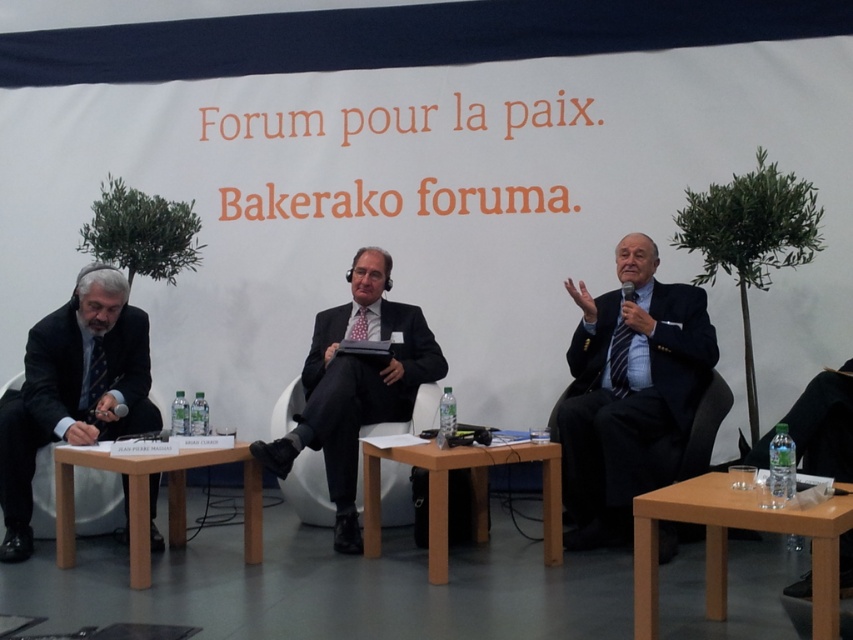
Can you confirm if dark blue wool suit at left is positioned to the right of light brown wooden table at center?

No, dark blue wool suit at left is not to the right of light brown wooden table at center.

Locate an element on the screen. dark blue wool suit at left is located at coordinates (42, 404).

Does point (109, 380) lie behind point (480, 515)?

No.

Locate an element on the screen. This screenshot has width=853, height=640. dark blue wool suit at left is located at coordinates (42, 404).

Between dark blue wool suit at left and black matte suit at center, which one has more height?

Standing taller between the two is black matte suit at center.

Find the location of a particular element. dark blue wool suit at left is located at coordinates (42, 404).

I want to click on dark blue wool suit at left, so click(x=42, y=404).

Between light brown wooden table at center and light brown wood table at center, which one is positioned higher?

Positioned higher is light brown wooden table at center.

Is point (543, 513) closer to viewer compared to point (142, 544)?

No, it is behind (142, 544).

Which is behind, point (552, 492) or point (141, 456)?

The point (552, 492) is more distant.

At what (x,y) coordinates should I click in order to perform the action: click on light brown wooden table at center. Please return your answer as a coordinate pair (x, y). The image size is (853, 640). Looking at the image, I should click on (471, 490).